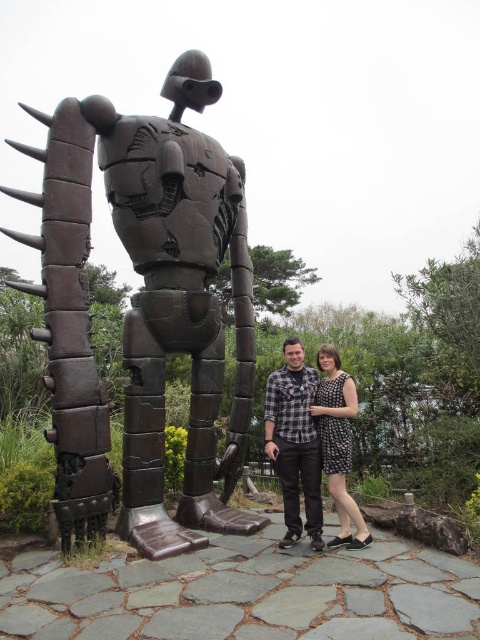
You are a photographer trying to capture a group photo of everyone in the scene. The bronze metallic robot at center and the checkered fabric shirt at center are two subjects in your frame. Given that your camera has a depth of field that can focus sharply on objects within 7 feet, will both subjects be in focus?

The bronze metallic robot at center and checkered fabric shirt at center are 7.68 feet apart. Since the camera can only focus sharply within 7 feet, the distance between them exceeds the depth of field range. Therefore, both subjects cannot be in focus simultaneously.

Consider the image. You are standing at the center of the stone area and want to take a photo of the bronze metallic robot at center. Which direction should you face to ensure the robot is in the frame?

Since the bronze metallic robot at center is located at point (144, 308), you should face towards the center area to capture it in your photo.

You are standing in front of the robot sculpture and see a point at coordinates (295, 442). What object is located at that point?

The point at coordinates (295, 442) corresponds to the checkered fabric shirt at center.